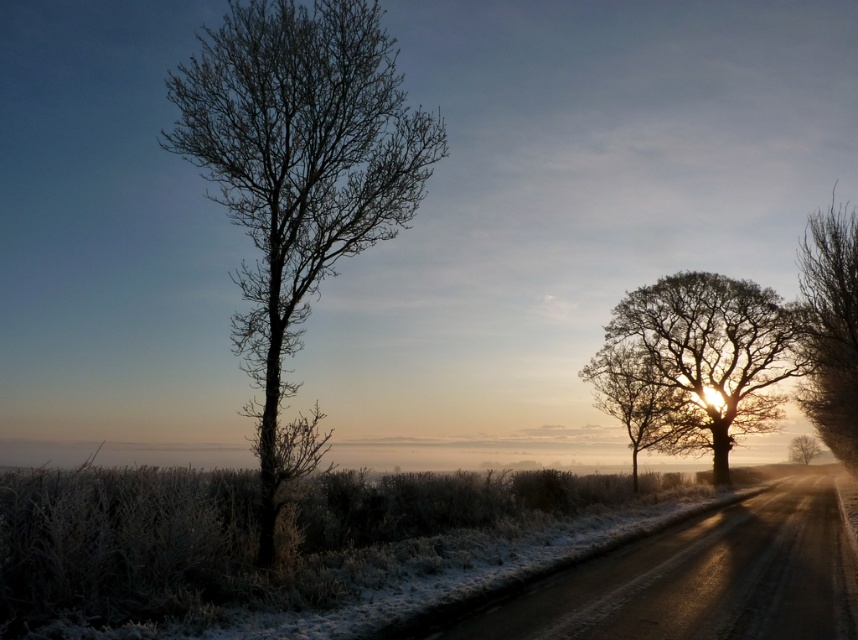
You are driving a car that is 5 meters long. You see the bare branches at left and the silhouetted bark tree at right along the roadside. Can your car fit between them without touching either?

The distance between the bare branches at left and the silhouetted bark tree at right is 18.88 meters. Since your car is only 5 meters long, there is more than enough space for it to fit between them without touching either.

You are a photographer wanting to capture the silvery frosty tree at right and the smooth brown tree at right in the same frame. Given their sizes, which tree would appear closer to the camera when positioned similarly in the shot?

The silvery frosty tree at right is larger in size than the smooth brown tree at right, so it would appear closer to the camera in the same frame.

You are a photographer wanting to capture both the silvery frosty tree at right and the smooth brown tree at right in a single shot. Which tree should you focus on first to ensure both are in focus?

You should focus on the silvery frosty tree at right first since it is closer to the viewer than the smooth brown tree at right, allowing the depth of field to include both trees in focus.